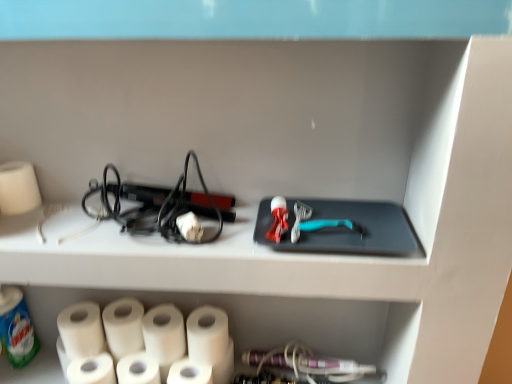
You are a GUI agent. You are given a task and a screenshot of the screen. Output one action in this format:
    pyautogui.click(x=<x>, y=<y>)
    Task: Click on the vacant space to the right of white matte paper towel at left, acting as the 7th paper towel starting from the right
    
    Given the screenshot: What is the action you would take?
    pyautogui.click(x=76, y=214)